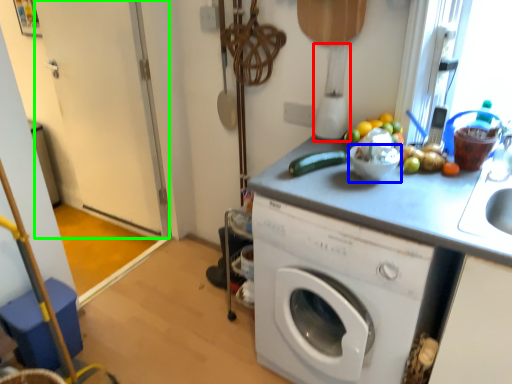
Question: Which object is the farthest from blender (highlighted by a red box)? Choose among these: basin (highlighted by a blue box) or screen door (highlighted by a green box).

Choices:
 (A) basin
 (B) screen door

Answer: (B)